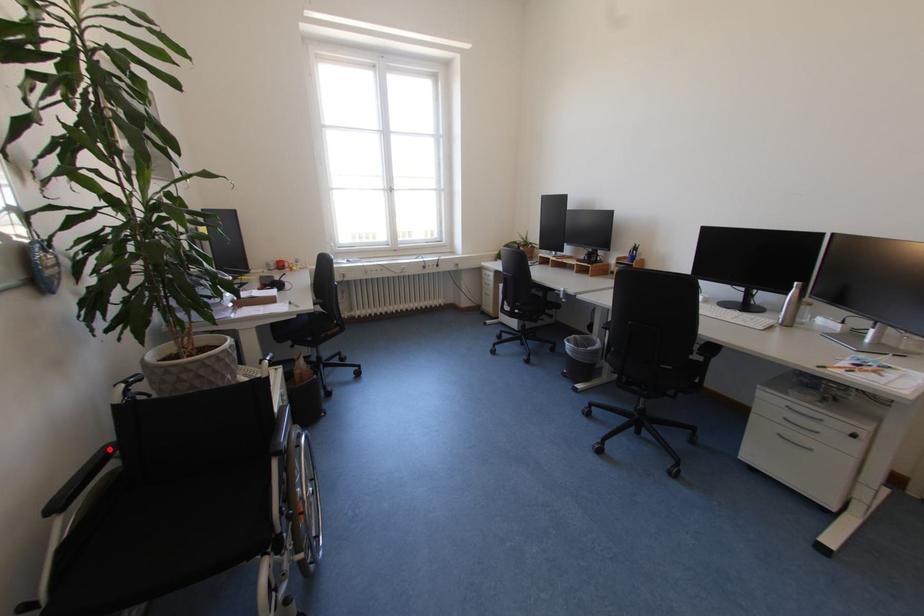
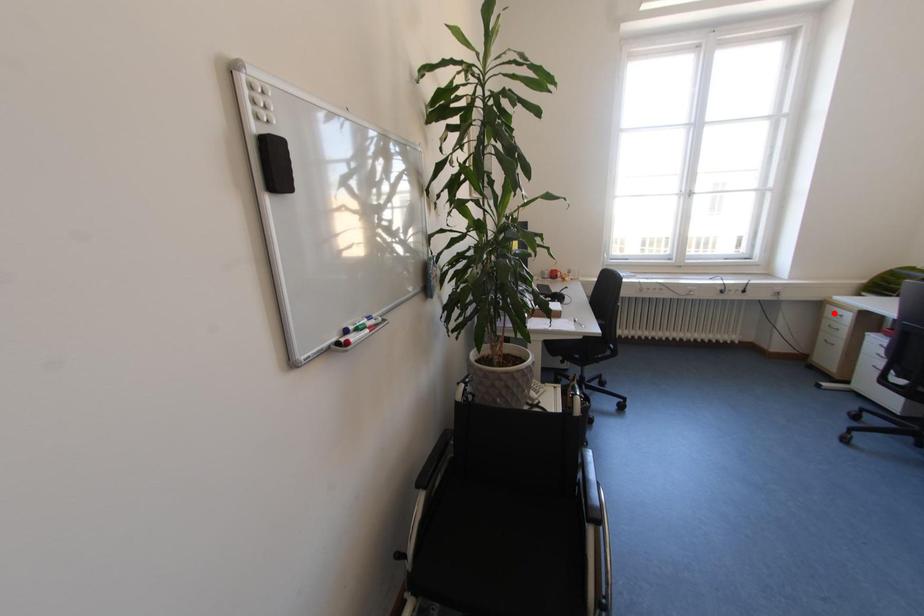
I am providing you with two images of the same scene from different viewpoints. A red point is marked on the first image and another point is marked on the second image. Is the red point in image1 aligned with the point shown in image2?

No